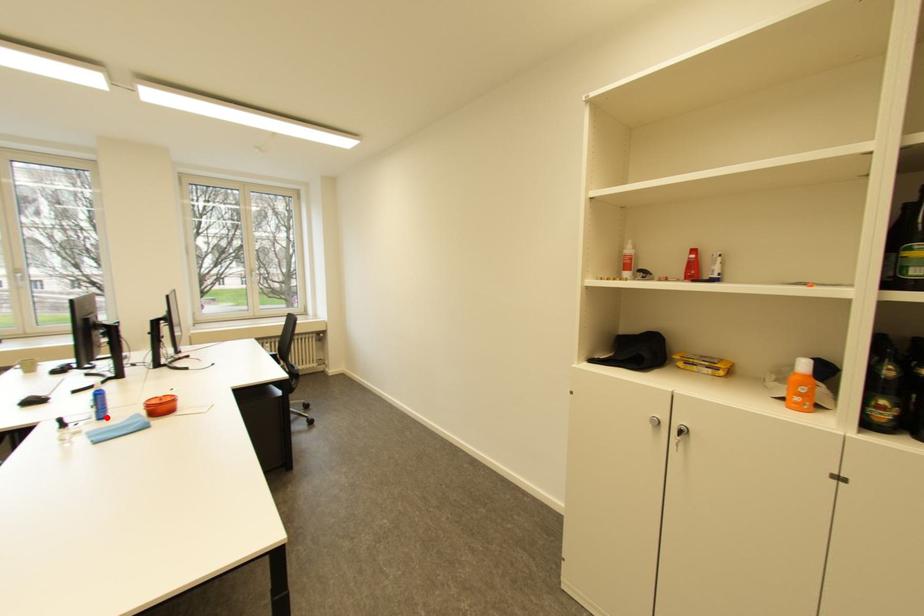
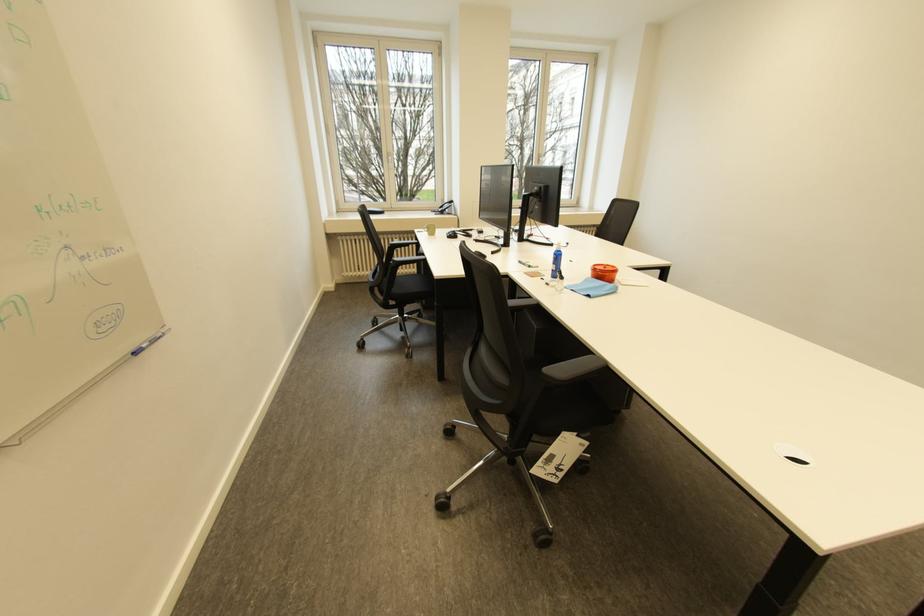
In the second image, find the point that corresponds to the highlighted location in the first image.

(562, 276)